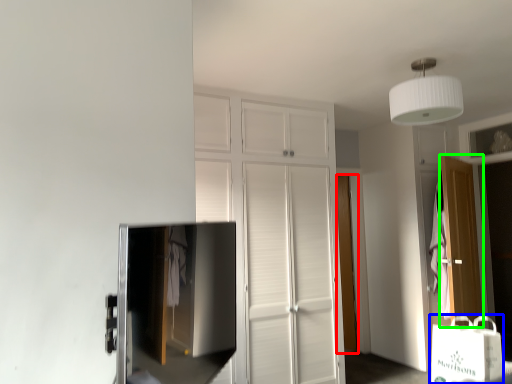
Question: Which object is positioned closest to door (highlighted by a red box)? Select from shopping bag (highlighted by a blue box) and door (highlighted by a green box).

Choices:
 (A) shopping bag
 (B) door

Answer: (B)